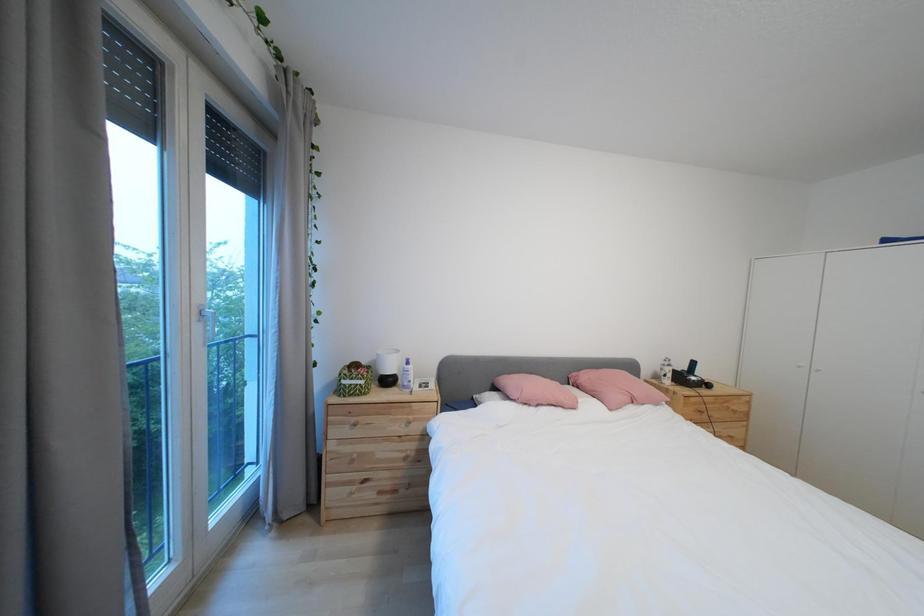
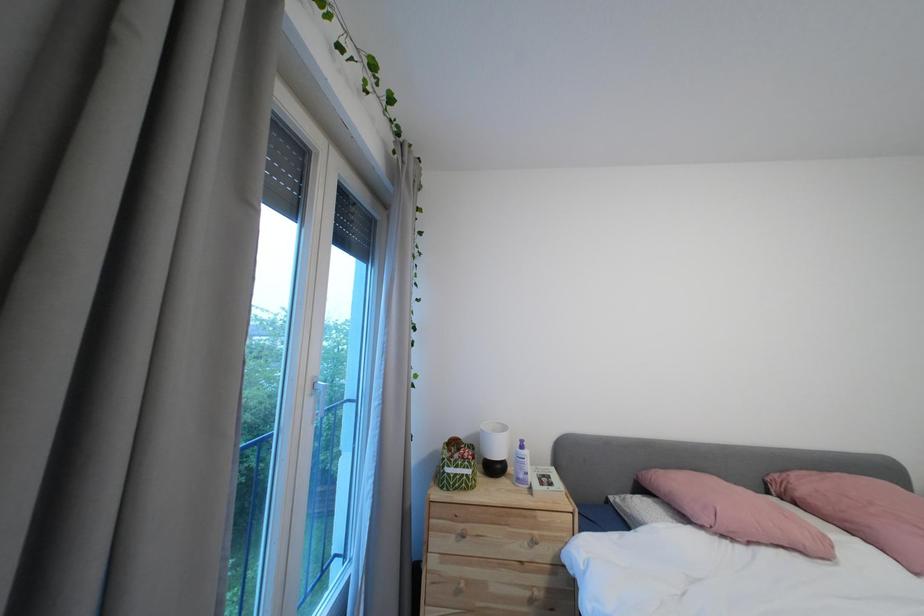
Question: The first image is from the beginning of the video and the second image is from the end. How did the camera likely rotate when shooting the video?

Choices:
 (A) Left
 (B) Right
 (C) Up
 (D) Down

Answer: (A)